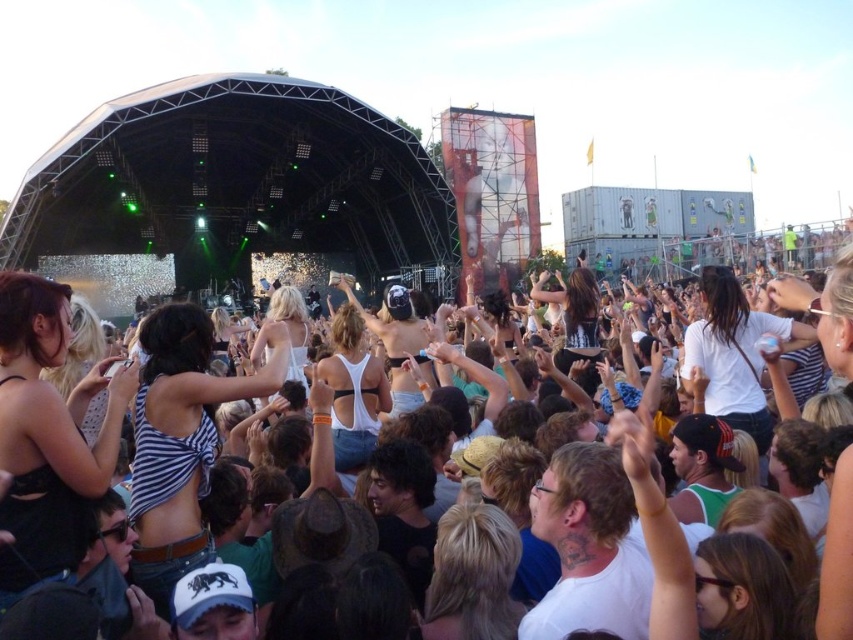
Which of these two, white fabric crowd at center or white matte bikini top at center, stands shorter?

Standing shorter between the two is white matte bikini top at center.

Who is positioned more to the left, white fabric crowd at center or white matte bikini top at center?

white matte bikini top at center is more to the left.

Find the location of `white fabric crowd at center`. white fabric crowd at center is located at coordinates (837, 557).